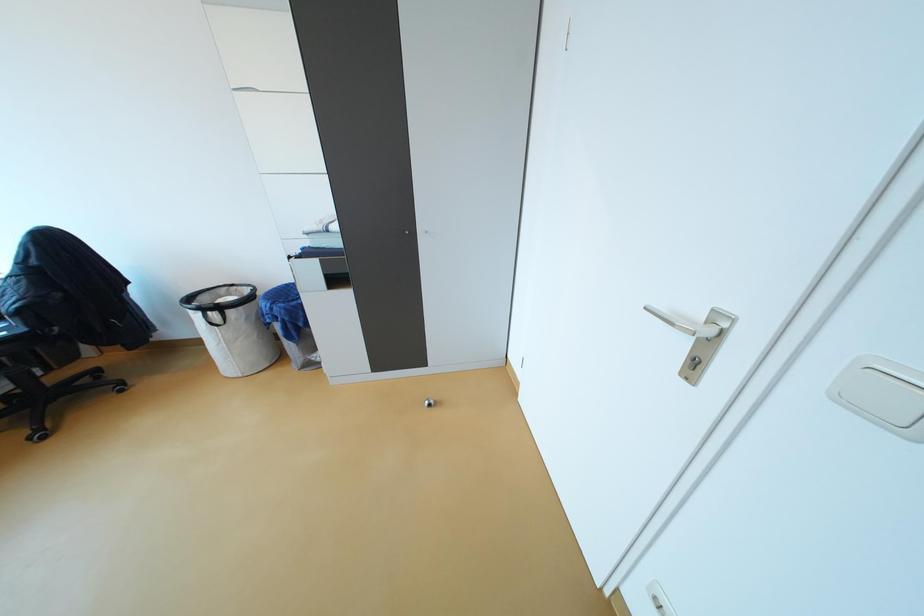
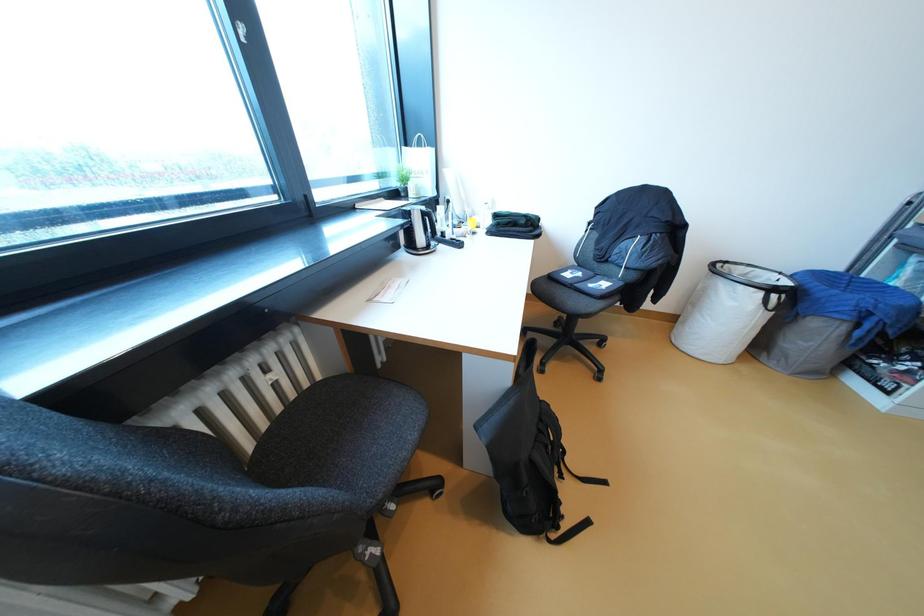
Question: The images are taken continuously from a first-person perspective. In which direction are you moving?

Choices:
 (A) Left
 (B) Right
 (C) Forward
 (D) Backward

Answer: (A)